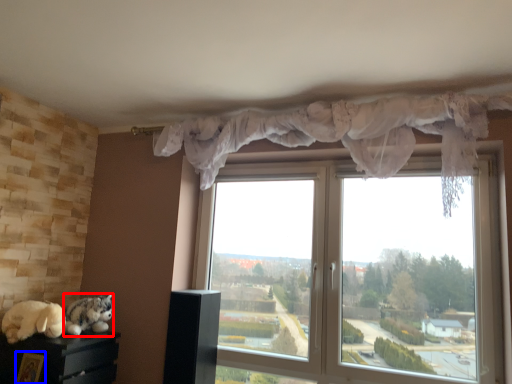
Question: Among these objects, which one is farthest to the camera, cat (highlighted by a red box) or picture frame (highlighted by a blue box)?

Choices:
 (A) cat
 (B) picture frame

Answer: (A)